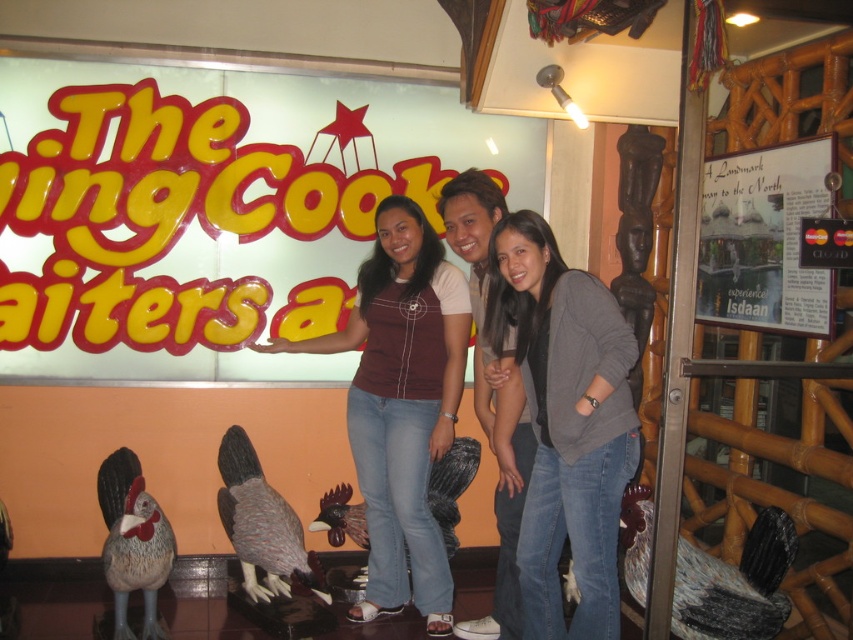
Question: Can you confirm if maroon fabric shirt at center is positioned above matte gray rooster at center?

Choices:
 (A) yes
 (B) no

Answer: (B)

Question: Which is farther from the matte gray rooster at center?

Choices:
 (A) white paper sign at upper right
 (B) maroon fabric shirt at center

Answer: (A)

Question: Which object is closer to the camera taking this photo?

Choices:
 (A) maroon fabric shirt at center
 (B) gray matte sweater at center
 (C) matte gray rooster at center
 (D) white paper sign at upper right

Answer: (B)

Question: Based on their relative distances, which object is farther from the gray matte sweater at center?

Choices:
 (A) white paper sign at upper right
 (B) maroon fabric shirt at center
 (C) matte gray rooster at center

Answer: (A)

Question: Does gray matte sweater at center appear under matte gray rooster at center?

Choices:
 (A) yes
 (B) no

Answer: (A)

Question: From the image, what is the correct spatial relationship of gray matte sweater at center in relation to maroon fabric shirt at center?

Choices:
 (A) left
 (B) right

Answer: (B)